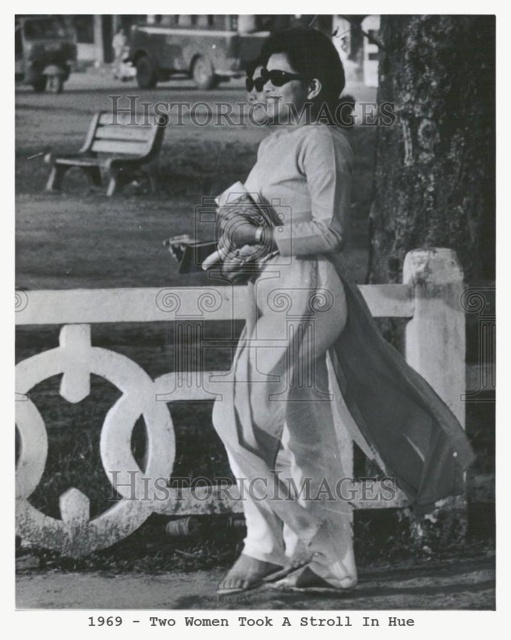
Can you confirm if wooden park bench at left is smaller than black plastic goggles at upper center?

No, wooden park bench at left is not smaller than black plastic goggles at upper center.

In the scene shown: Can you confirm if wooden park bench at left is positioned to the right of black plastic goggles at upper center?

Incorrect, wooden park bench at left is not on the right side of black plastic goggles at upper center.

Locate an element on the screen. The image size is (511, 640). wooden park bench at left is located at coordinates (109, 150).

Is silky white ao dai at center below wooden park bench at left?

Indeed, silky white ao dai at center is positioned under wooden park bench at left.

Which is more to the left, silky white ao dai at center or wooden park bench at left?

wooden park bench at left

What do you see at coordinates (314, 349) in the screenshot?
I see `silky white ao dai at center` at bounding box center [314, 349].

Find the location of a particular element. The height and width of the screenshot is (640, 511). silky white ao dai at center is located at coordinates (314, 349).

Does silky white ao dai at center have a lesser width compared to black plastic goggles at upper center?

No, silky white ao dai at center is not thinner than black plastic goggles at upper center.

Does point (363, 310) come farther from viewer compared to point (273, 81)?

Yes, it is.

Between point (406, 372) and point (272, 68), which one is positioned behind?

The point (406, 372) is more distant.

The width and height of the screenshot is (511, 640). Find the location of `silky white ao dai at center`. silky white ao dai at center is located at coordinates (314, 349).